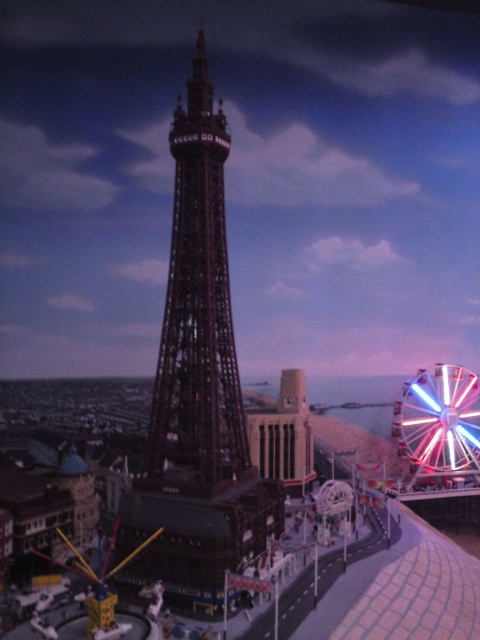
Question: Among these points, which one is farthest from the camera?

Choices:
 (A) (147, 490)
 (B) (374, 618)
 (C) (460, 394)

Answer: (C)

Question: Among these objects, which one is nearest to the camera?

Choices:
 (A) shiny metallic carousel at center
 (B) black matte tower at center
 (C) multicolored metallic ferris wheel at lower right

Answer: (A)

Question: Does black matte tower at center have a smaller size compared to multicolored metallic ferris wheel at lower right?

Choices:
 (A) no
 (B) yes

Answer: (A)

Question: Which point appears farthest from the camera in this image?

Choices:
 (A) (227, 528)
 (B) (410, 422)
 (C) (206, 566)

Answer: (B)

Question: Is black matte tower at center to the right of multicolored metallic ferris wheel at lower right from the viewer's perspective?

Choices:
 (A) yes
 (B) no

Answer: (B)

Question: Is black matte tower at center below multicolored metallic ferris wheel at lower right?

Choices:
 (A) no
 (B) yes

Answer: (A)